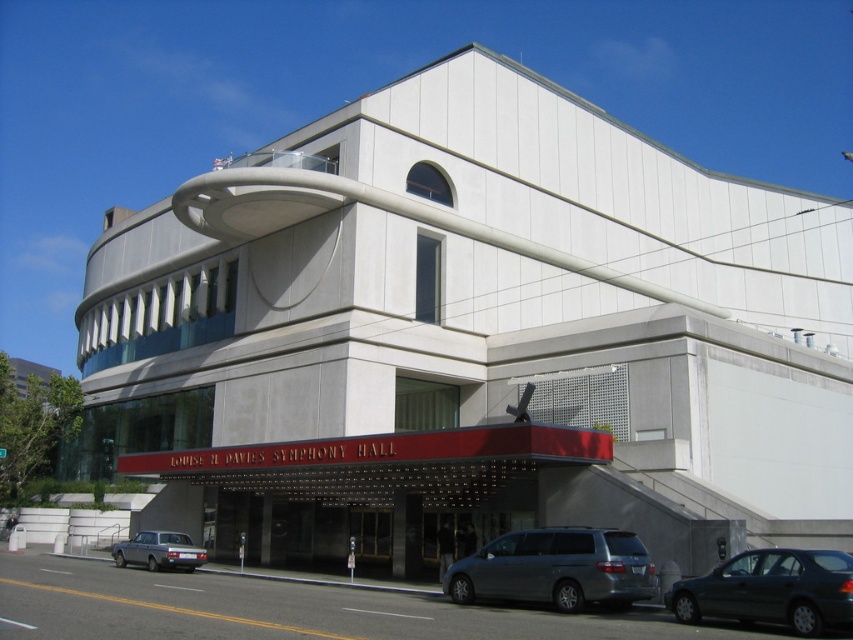
Question: Among these objects, which one is nearest to the camera?

Choices:
 (A) dark gray metallic sedan at lower right
 (B) silver metallic minivan at lower center

Answer: (A)

Question: Does dark gray metallic sedan at lower right have a smaller size compared to silver metallic station wagon at lower left?

Choices:
 (A) yes
 (B) no

Answer: (A)

Question: Among these points, which one is nearest to the camera?

Choices:
 (A) (578, 609)
 (B) (805, 548)
 (C) (149, 568)

Answer: (A)

Question: From the image, what is the correct spatial relationship of silver metallic minivan at lower center in relation to silver metallic station wagon at lower left?

Choices:
 (A) above
 (B) below

Answer: (A)

Question: Which is nearer to the silver metallic minivan at lower center?

Choices:
 (A) silver metallic station wagon at lower left
 (B) dark gray metallic sedan at lower right

Answer: (B)

Question: From the image, what is the correct spatial relationship of silver metallic minivan at lower center in relation to silver metallic station wagon at lower left?

Choices:
 (A) below
 (B) above

Answer: (B)